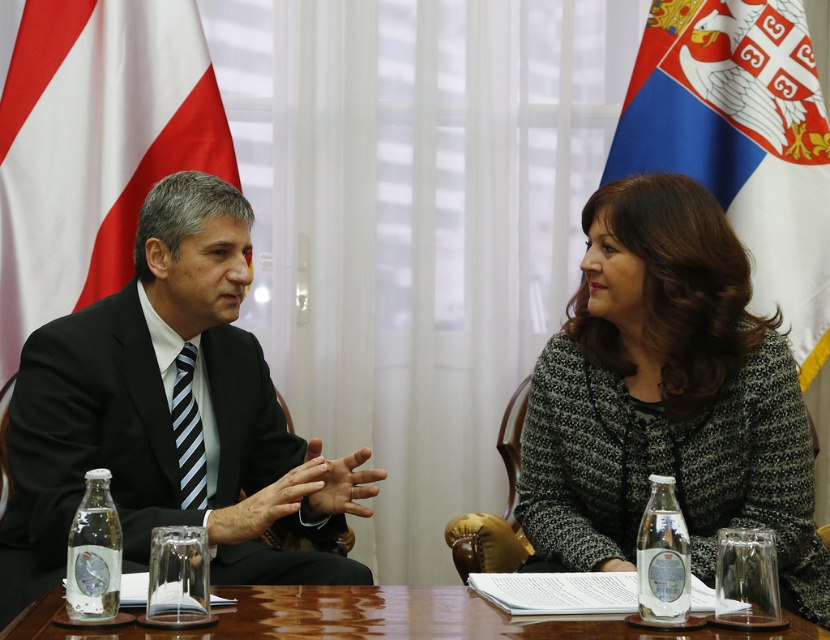
Question: Is black suit at center positioned in front of wooden table at center?

Choices:
 (A) yes
 (B) no

Answer: (B)

Question: Which object is closer to the camera taking this photo?

Choices:
 (A) white fabric flag at left
 (B) wooden table at center
 (C) black suit at center

Answer: (B)

Question: Does white fabric flag at left come behind wooden table at center?

Choices:
 (A) no
 (B) yes

Answer: (B)

Question: Can you confirm if black suit at center is positioned to the left of wooden table at center?

Choices:
 (A) no
 (B) yes

Answer: (B)

Question: Which object is farther from the camera taking this photo?

Choices:
 (A) white fabric flag at left
 (B) wooden table at center
 (C) white fabric flag at right
 (D) black suit at center

Answer: (C)

Question: Estimate the real-world distances between objects in this image. Which object is farther from the white fabric flag at left?

Choices:
 (A) white fabric flag at right
 (B) speckled woolen sweater at center
 (C) black suit at center
 (D) wooden table at center

Answer: (A)